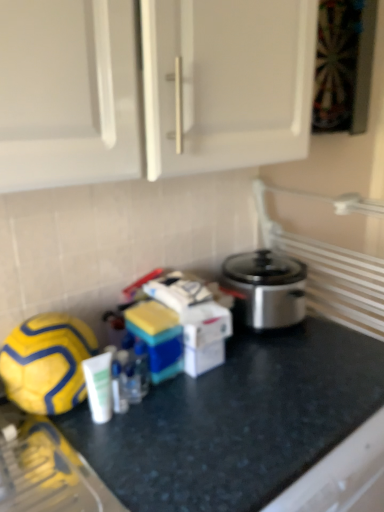
Question: Can you confirm if black granite countertop at center is wider than yellow matte football at lower left?

Choices:
 (A) no
 (B) yes

Answer: (B)

Question: Is black granite countertop at center in contact with yellow matte football at lower left?

Choices:
 (A) no
 (B) yes

Answer: (A)

Question: From a real-world perspective, is black granite countertop at center under yellow matte football at lower left?

Choices:
 (A) no
 (B) yes

Answer: (B)

Question: Are black granite countertop at center and yellow matte football at lower left located far from each other?

Choices:
 (A) no
 (B) yes

Answer: (A)

Question: From the image's perspective, is black granite countertop at center located beneath yellow matte football at lower left?

Choices:
 (A) no
 (B) yes

Answer: (B)

Question: Does black granite countertop at center have a larger size compared to yellow matte football at lower left?

Choices:
 (A) no
 (B) yes

Answer: (B)

Question: Does yellow matte football at lower left appear on the left side of black granite countertop at center?

Choices:
 (A) no
 (B) yes

Answer: (B)

Question: Is yellow matte football at lower left oriented away from black granite countertop at center?

Choices:
 (A) no
 (B) yes

Answer: (A)

Question: Can you confirm if yellow matte football at lower left is positioned to the right of black granite countertop at center?

Choices:
 (A) no
 (B) yes

Answer: (A)

Question: From the image's perspective, is yellow matte football at lower left located beneath black granite countertop at center?

Choices:
 (A) yes
 (B) no

Answer: (B)

Question: Does yellow matte football at lower left have a lesser width compared to black granite countertop at center?

Choices:
 (A) no
 (B) yes

Answer: (B)

Question: Does yellow matte football at lower left have a smaller size compared to black granite countertop at center?

Choices:
 (A) no
 (B) yes

Answer: (B)

Question: Looking at their shapes, would you say yellow matte football at lower left is wider or thinner than black granite countertop at center?

Choices:
 (A) thin
 (B) wide

Answer: (A)